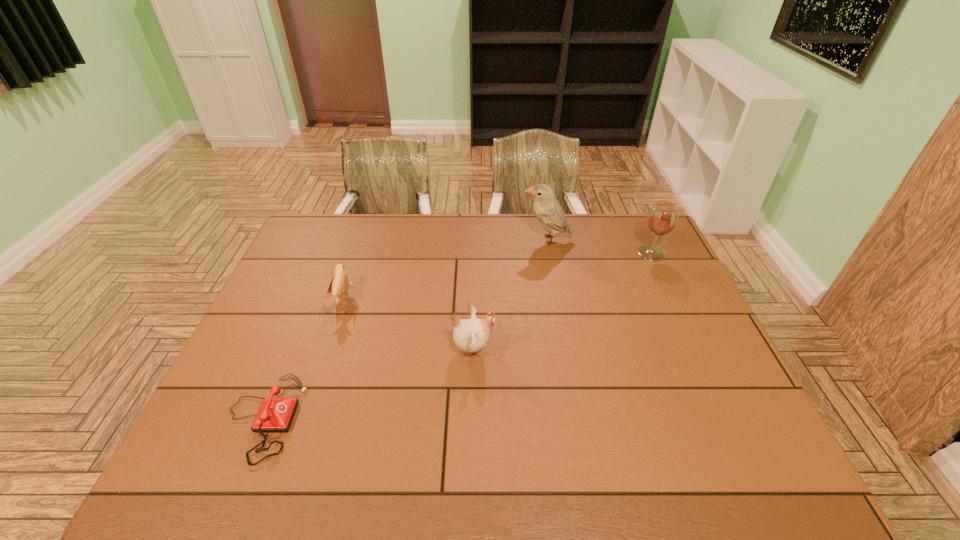
Find the location of a particular element. object located at the right edge is located at coordinates (662, 217).

Where is `object located in the near left corner section of the desktop`? This screenshot has height=540, width=960. object located in the near left corner section of the desktop is located at coordinates (275, 414).

At what (x,y) coordinates should I click in order to perform the action: click on object present at the far right corner. Please return your answer as a coordinate pair (x, y). The width and height of the screenshot is (960, 540). Looking at the image, I should click on (662, 217).

In the image, there is a desktop. Identify the location of vacant area at the far edge. This screenshot has height=540, width=960. (475, 213).

I want to click on vacant space at the near edge of the desktop, so click(528, 480).

Where is `free space at the left edge`? free space at the left edge is located at coordinates (228, 402).

The width and height of the screenshot is (960, 540). I want to click on vacant space at the right edge of the desktop, so pos(661,299).

Where is `vacant region at the far right corner of the desktop`? The width and height of the screenshot is (960, 540). vacant region at the far right corner of the desktop is located at coordinates (665, 248).

The width and height of the screenshot is (960, 540). Find the location of `free spot between the third nearest object and the nearest bird`. free spot between the third nearest object and the nearest bird is located at coordinates coord(407,326).

Find the location of a particular element. The image size is (960, 540). free space between the second shortest bird and the second tallest object is located at coordinates (563, 301).